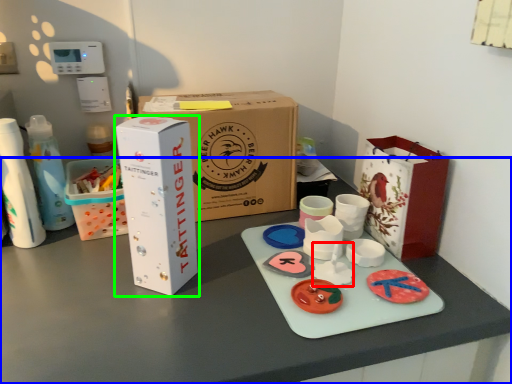
Question: Which object is positioned farthest from toy (highlighted by a red box)? Select from table (highlighted by a blue box) and box (highlighted by a green box).

Choices:
 (A) table
 (B) box

Answer: (B)